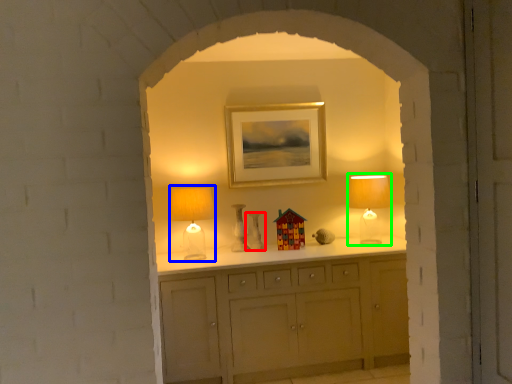
Question: Which is nearer to the vase (highlighted by a red box)? table lamp (highlighted by a blue box) or table lamp (highlighted by a green box).

Choices:
 (A) table lamp
 (B) table lamp

Answer: (A)